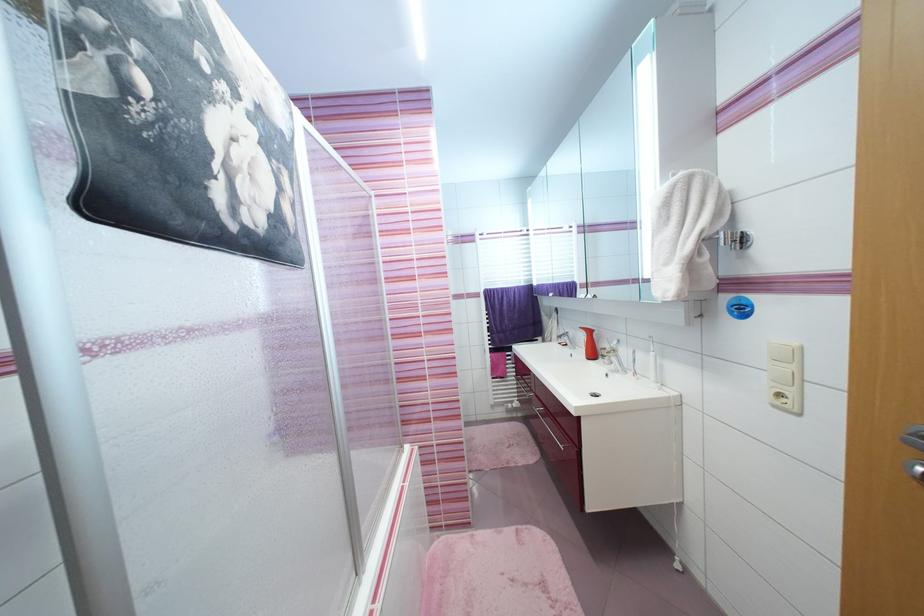
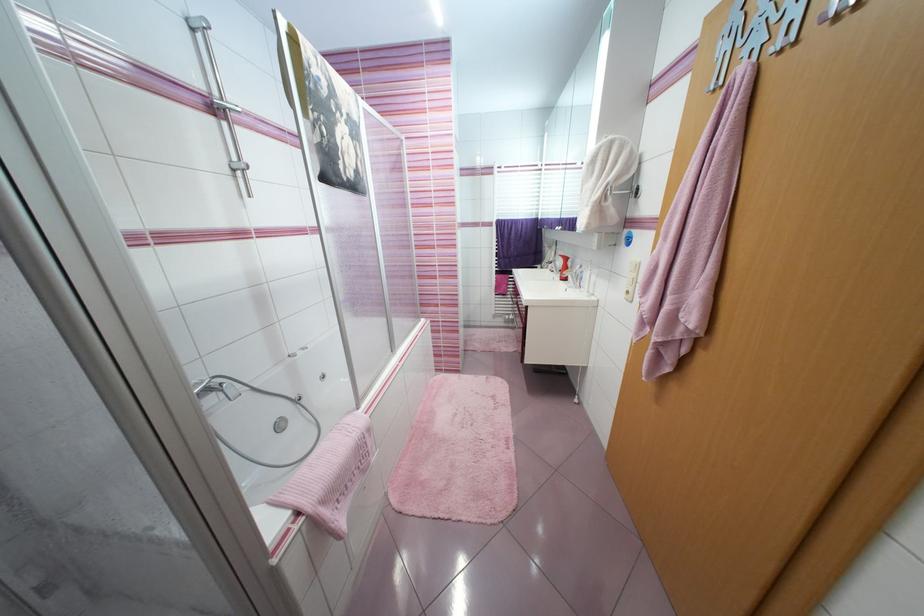
The point at (536, 277) is marked in the first image. Where is the corresponding point in the second image?

(543, 211)